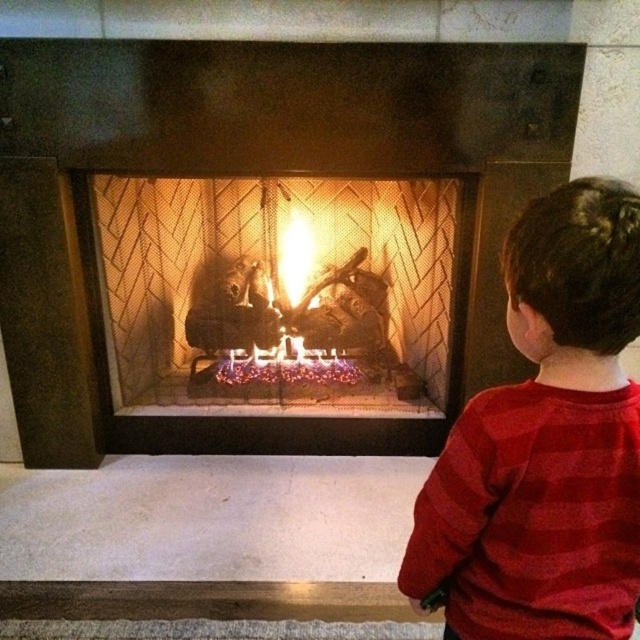
Based on the photo, you are standing in front of the fireplace and want to take a photo of the matte black fireplace at center with your phone. Your phone has a minimum focus distance of 2 meters. Will the fireplace be in focus?

The matte black fireplace at center is 1.98 meters away from camera, which is slightly less than the phone minimum focus distance of 2 meters. Therefore, the phone will not be able to focus on the fireplace.

You are a parent watching your child from across the room. You see the red striped shirt at right and the glowing embers at center. Which object is closer to the right side of the fireplace?

The red striped shirt at right is positioned on the right side of glowing embers at center, so it is closer to the right side of the fireplace.